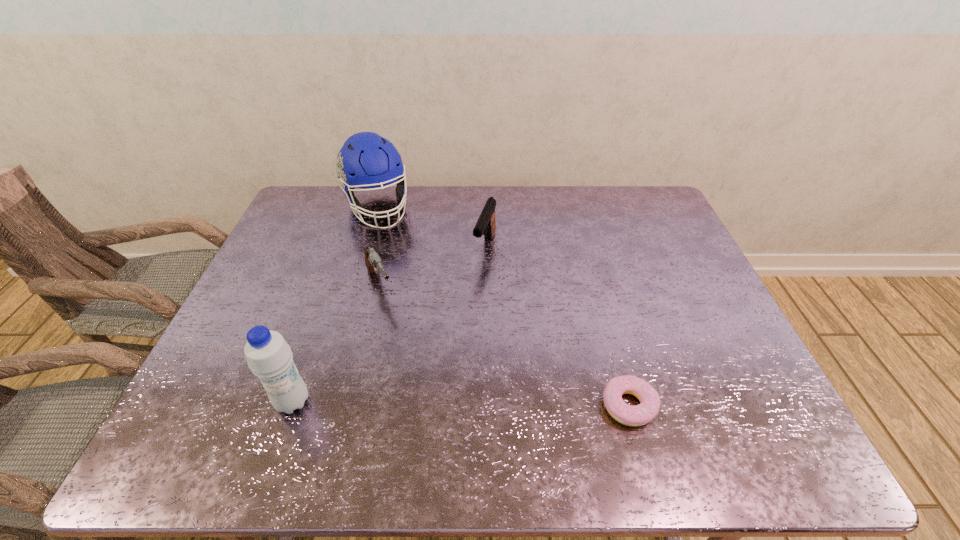
The height and width of the screenshot is (540, 960). I want to click on free point that satisfies the following two spatial constraints: 1. on the front side of the football helmet; 2. on the left side of the taller pistol, so click(366, 247).

Image resolution: width=960 pixels, height=540 pixels. Find the location of `vacant space that satisfies the following two spatial constraints: 1. on the back side of the third shortest object; 2. on the left side of the water bottle`. vacant space that satisfies the following two spatial constraints: 1. on the back side of the third shortest object; 2. on the left side of the water bottle is located at coordinates (347, 247).

The image size is (960, 540). Identify the location of free space that satisfies the following two spatial constraints: 1. on the back side of the water bottle; 2. on the left side of the left pistol. (334, 284).

Image resolution: width=960 pixels, height=540 pixels. What are the coordinates of `vacant point that satisfies the following two spatial constraints: 1. on the front side of the doughnut; 2. on the left side of the right pistol` in the screenshot? It's located at point(487,406).

The image size is (960, 540). What are the coordinates of `free region that satisfies the following two spatial constraints: 1. on the front side of the football helmet; 2. on the left side of the doughnut` in the screenshot? It's located at (318, 406).